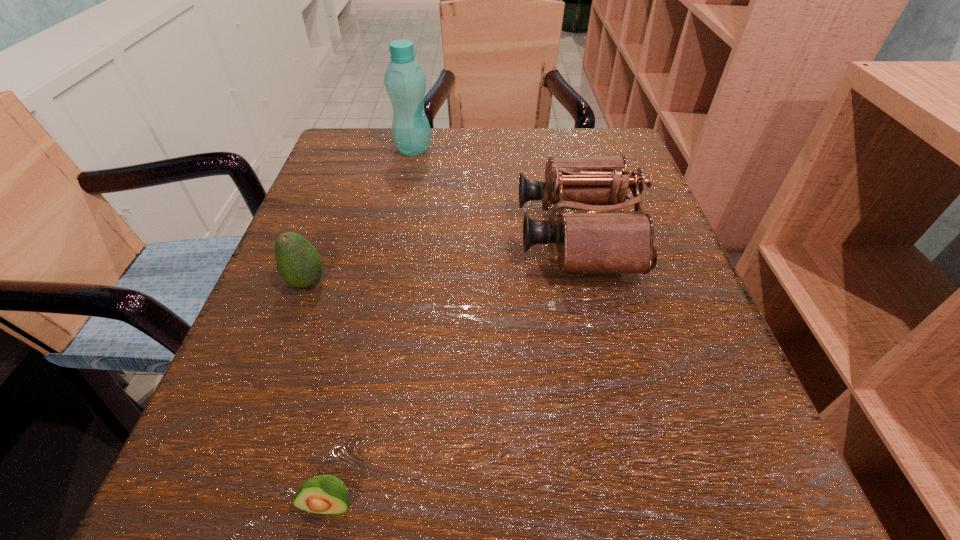
In the image, there is a desktop. Where is `vacant space at the left edge`? vacant space at the left edge is located at coordinates (327, 330).

What are the coordinates of `vacant space at the right edge` in the screenshot? It's located at (693, 363).

This screenshot has height=540, width=960. What are the coordinates of `vacant area at the far left corner` in the screenshot? It's located at (346, 149).

This screenshot has width=960, height=540. In order to click on vacant space at the near left corner of the desktop in this screenshot , I will do `click(242, 468)`.

Locate an element on the screen. Image resolution: width=960 pixels, height=540 pixels. free location at the far right corner of the desktop is located at coordinates (558, 139).

You are a GUI agent. You are given a task and a screenshot of the screen. Output one action in this format:
    pyautogui.click(x=<x>, y=<y>)
    Task: Click on the vacant space that's between the farther avocado and the farthest object
    The image size is (960, 540).
    Given the screenshot: What is the action you would take?
    pyautogui.click(x=360, y=216)

You are a GUI agent. You are given a task and a screenshot of the screen. Output one action in this format:
    pyautogui.click(x=<x>, y=<y>)
    Task: Click on the free space between the farthest object and the farther avocado
    Image resolution: width=960 pixels, height=540 pixels.
    Given the screenshot: What is the action you would take?
    coord(360,216)

Locate an element on the screen. This screenshot has width=960, height=540. vacant area between the nearest object and the rightmost object is located at coordinates (453, 369).

This screenshot has width=960, height=540. I want to click on vacant area that lies between the shorter avocado and the bottle, so click(372, 327).

Find the location of a particular element. Image resolution: width=960 pixels, height=540 pixels. vacant space that's between the left avocado and the shortest object is located at coordinates pyautogui.click(x=319, y=393).